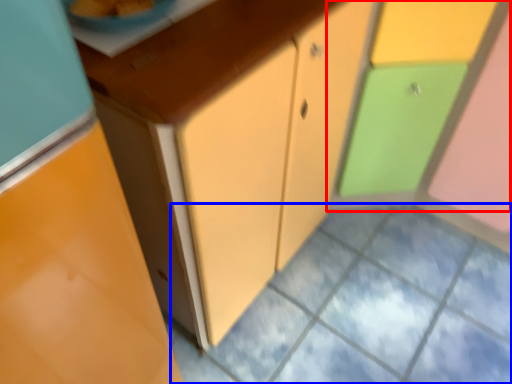
Question: Which point is closer to the camera, cabinetry (highlighted by a red box) or square (highlighted by a blue box)?

Choices:
 (A) cabinetry
 (B) square

Answer: (A)